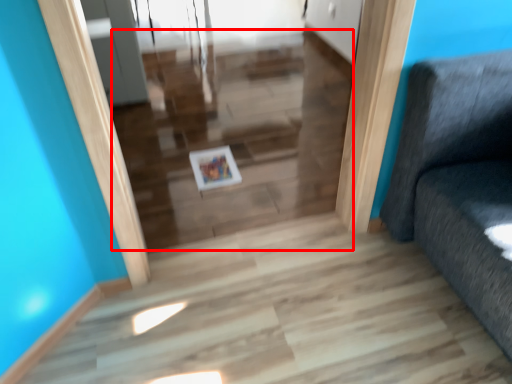
Question: Considering the relative positions of stairwell (annotated by the red box) and picture frame in the image provided, where is stairwell (annotated by the red box) located with respect to the staircase?

Choices:
 (A) right
 (B) left

Answer: (A)